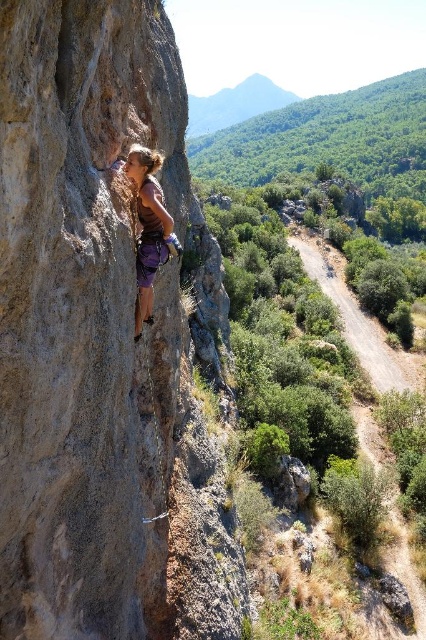
You are a safety inspector assessing the climbing setup. The minimum safe distance between the climber and the rock face is 7 feet to allow for movement. Given the distance between the brown rough rock at left and the purple fabric climbing harness at center, is the current setup within safety guidelines?

The brown rough rock at left and purple fabric climbing harness at center are 8.19 feet apart from each other. Since the minimum safe distance is 7 feet, the current setup is within safety guidelines as the distance exceeds the required minimum.

You are a climber looking at the cliff face. You see the brown rough rock at left and the purple fabric climbing harness at center. Which object is positioned to the right of the other?

The brown rough rock at left is positioned to the right of the purple fabric climbing harness at center.

You are a rock climber preparing to ascend a cliff. You notice a brown rough rock at left and a purple fabric climbing harness at center. Which object is wider?

The brown rough rock at left is wider than the purple fabric climbing harness at center.